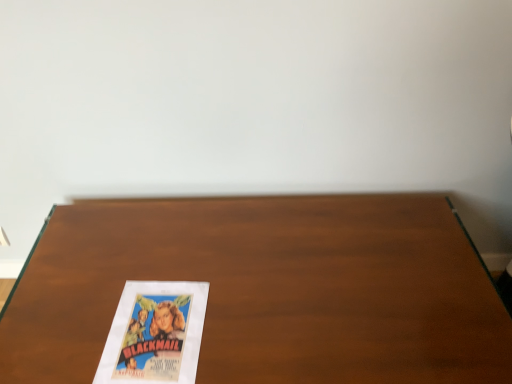
What do you see at coordinates (269, 290) in the screenshot? I see `wooden table at center` at bounding box center [269, 290].

In order to face wooden table at center, should I rotate leftwards or rightwards?

Turn right approximately 0.061 degrees to face it.

What is the approximate width of wooden table at center?

→ wooden table at center is 22.84 inches in width.

What is the approximate height of wooden table at center?

wooden table at center is 16.23 inches tall.

Image resolution: width=512 pixels, height=384 pixels. Identify the location of wooden table at center. [269, 290].

Where is `vintage paper at bottom left`? vintage paper at bottom left is located at coordinates (155, 333).

Describe the element at coordinates (155, 333) in the screenshot. The image size is (512, 384). I see `vintage paper at bottom left` at that location.

The height and width of the screenshot is (384, 512). Identify the location of wooden table at center. (269, 290).

Can you confirm if vintage paper at bottom left is positioned to the left of wooden table at center?

Yes, vintage paper at bottom left is to the left of wooden table at center.

In the scene shown: Relative to wooden table at center, is vintage paper at bottom left in front or behind?

vintage paper at bottom left is positioned closer to the viewer than wooden table at center.

Does point (180, 311) appear closer or farther from the camera than point (495, 290)?

Point (180, 311).

From the image's perspective, is vintage paper at bottom left below wooden table at center?

Incorrect, from the image's perspective, vintage paper at bottom left is higher than wooden table at center.

From a real-world perspective, is vintage paper at bottom left physically below wooden table at center?

Incorrect, from a real-world perspective, vintage paper at bottom left is higher than wooden table at center.

Considering the relative sizes of vintage paper at bottom left and wooden table at center in the image provided, is vintage paper at bottom left wider than wooden table at center?

No, vintage paper at bottom left is not wider than wooden table at center.

Does vintage paper at bottom left have a greater height compared to wooden table at center?

In fact, vintage paper at bottom left may be shorter than wooden table at center.

Consider the image. Which of these two, vintage paper at bottom left or wooden table at center, is smaller?

vintage paper at bottom left is smaller.

Is wooden table at center located within vintage paper at bottom left?

Definitely not — wooden table at center is not inside vintage paper at bottom left.

Is vintage paper at bottom left not near wooden table at center?

No, vintage paper at bottom left is not far from wooden table at center.

Could you tell me if vintage paper at bottom left is turned towards wooden table at center?

Yes, vintage paper at bottom left is oriented towards wooden table at center.

You are a GUI agent. You are given a task and a screenshot of the screen. Output one action in this format:
    pyautogui.click(x=<x>, y=<y>)
    Task: Click on the paperback book in front of the wooden table at center
    The width and height of the screenshot is (512, 384).
    Given the screenshot: What is the action you would take?
    pyautogui.click(x=155, y=333)

Between wooden table at center and vintage paper at bottom left, which one appears on the right side from the viewer's perspective?

Positioned to the right is wooden table at center.

Does wooden table at center come in front of vintage paper at bottom left?

No, the depth of wooden table at center is greater than that of vintage paper at bottom left.

Is point (35, 293) farther from viewer compared to point (157, 298)?

That is True.

From the image's perspective, would you say wooden table at center is shown under vintage paper at bottom left?

Yes, from the image's perspective, wooden table at center is beneath vintage paper at bottom left.

From a real-world perspective, who is located higher, wooden table at center or vintage paper at bottom left?

vintage paper at bottom left.

Between wooden table at center and vintage paper at bottom left, which one has larger width?

Wider between the two is wooden table at center.

Can you confirm if wooden table at center is taller than vintage paper at bottom left?

Indeed, wooden table at center has a greater height compared to vintage paper at bottom left.

Considering the relative sizes of wooden table at center and vintage paper at bottom left in the image provided, is wooden table at center bigger than vintage paper at bottom left?

Yes.

Would you say wooden table at center contains vintage paper at bottom left?

Indeed, vintage paper at bottom left is located within wooden table at center.

Is wooden table at center positioned far away from vintage paper at bottom left?

Actually, wooden table at center and vintage paper at bottom left are a little close together.

Is wooden table at center facing away from vintage paper at bottom left?

That's not correct — wooden table at center is not looking away from vintage paper at bottom left.

How many degrees apart are the facing directions of wooden table at center and vintage paper at bottom left?

wooden table at center and vintage paper at bottom left are facing 2.56 degrees away from each other.

I want to click on paperback book in front of the wooden table at center, so click(x=155, y=333).

You are a GUI agent. You are given a task and a screenshot of the screen. Output one action in this format:
    pyautogui.click(x=<x>, y=<y>)
    Task: Click on the paperback book on the left of wooden table at center
    The image size is (512, 384).
    Given the screenshot: What is the action you would take?
    (x=155, y=333)

The width and height of the screenshot is (512, 384). I want to click on table that appears on the right of vintage paper at bottom left, so click(x=269, y=290).